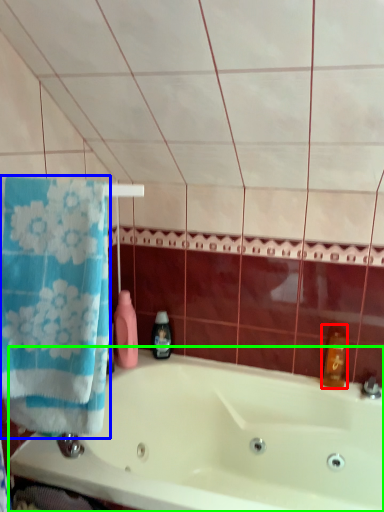
Question: Which object is positioned closest to cleaning product (highlighted by a red box)? Select from towel (highlighted by a blue box) and bathtub (highlighted by a green box).

Choices:
 (A) towel
 (B) bathtub

Answer: (B)